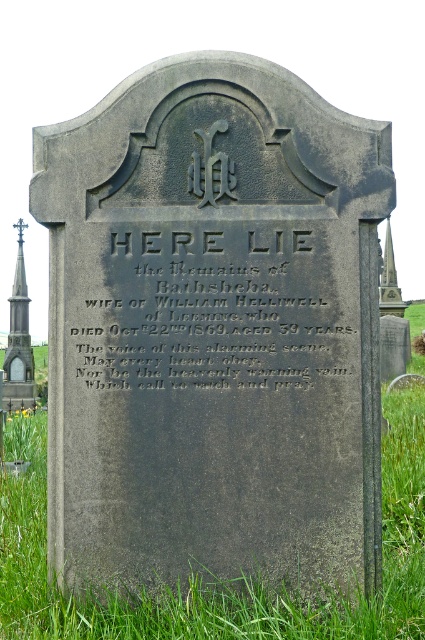
Is black stone inscription at center to the left of stone spire at right from the viewer's perspective?

Indeed, black stone inscription at center is positioned on the left side of stone spire at right.

Is black stone inscription at center closer to the viewer compared to stone spire at right?

Yes.

This screenshot has width=425, height=640. What are the coordinates of `black stone inscription at center` in the screenshot? It's located at (212, 308).

You are a GUI agent. You are given a task and a screenshot of the screen. Output one action in this format:
    pyautogui.click(x=<x>, y=<y>)
    Task: Click on the black stone inscription at center
    Image resolution: width=425 pixels, height=640 pixels.
    Given the screenshot: What is the action you would take?
    pyautogui.click(x=212, y=308)

Is black stone inscription at center to the left of green grass at lower center from the viewer's perspective?

Yes, black stone inscription at center is to the left of green grass at lower center.

Who is more forward, (93,385) or (175,614)?

Point (175,614) is in front.

Locate an element on the screen. The image size is (425, 640). black stone inscription at center is located at coordinates (212, 308).

Looking at this image, can you confirm if black stone inscription at center is smaller than polished stone spire at left?

Yes.

Between black stone inscription at center and polished stone spire at left, which one appears on the left side from the viewer's perspective?

polished stone spire at left

Which is behind, point (167, 241) or point (19, 262)?

Point (19, 262)

At what (x,y) coordinates should I click in order to perform the action: click on black stone inscription at center. Please return your answer as a coordinate pair (x, y). Looking at the image, I should click on (212, 308).